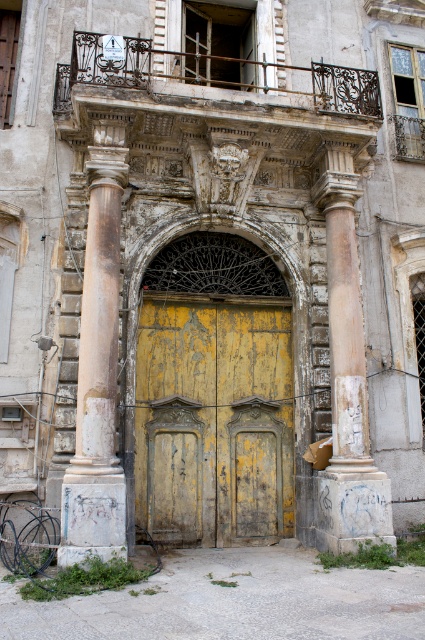
You are a painter who needs to move a ladder from the white stone column at left to the white marble column at center. The ladder is 4.5 meters long. Will the ladder reach the gap between them?

The distance between the white stone column at left and white marble column at center is 4.70 meters. Since the ladder is only 4.5 meters long, it will not be long enough to span the gap between them.

You are an architect inspecting the building entrance. You notice the white stone column at left and the white marble column at center. Which column has a greater width?

The white marble column at center has a greater width than the white stone column at left.